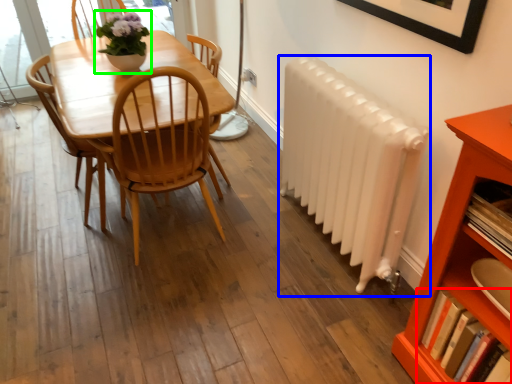
Question: Which is nearer to the book (highlighted by a red box)? radiator (highlighted by a blue box) or houseplant (highlighted by a green box).

Choices:
 (A) radiator
 (B) houseplant

Answer: (A)